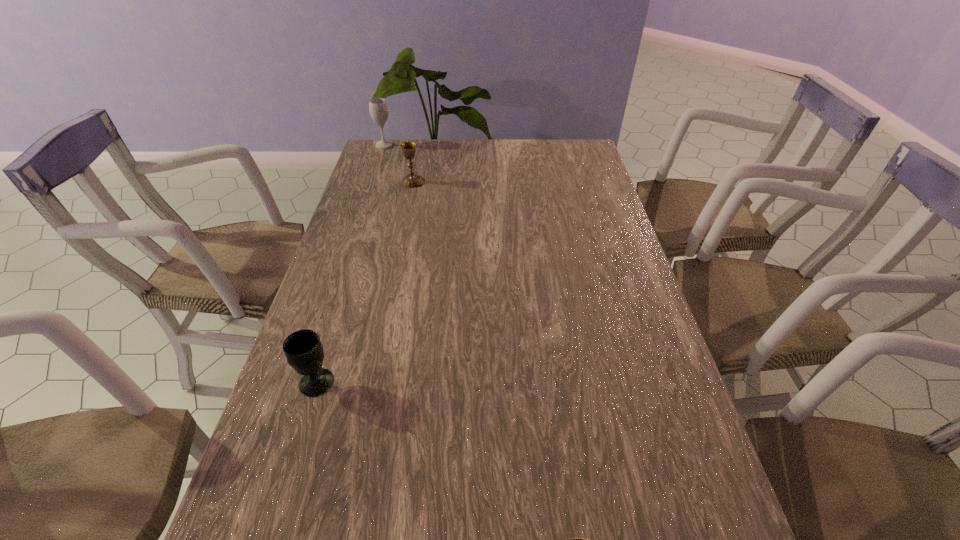
Locate an element on the screen. Image resolution: width=960 pixels, height=540 pixels. wineglass is located at coordinates (378, 108).

You are a GUI agent. You are given a task and a screenshot of the screen. Output one action in this format:
    pyautogui.click(x=<x>, y=<y>)
    Task: Click on the farthest object
    The height and width of the screenshot is (540, 960).
    Given the screenshot: What is the action you would take?
    pyautogui.click(x=378, y=108)

The image size is (960, 540). In order to click on the third object from left to right in this screenshot , I will do `click(413, 180)`.

Find the location of a particular element. This screenshot has width=960, height=540. the farthest chalice is located at coordinates (413, 180).

The image size is (960, 540). What are the coordinates of `the third farthest object` in the screenshot? It's located at (303, 349).

This screenshot has width=960, height=540. I want to click on the second nearest chalice, so click(x=303, y=349).

You are a GUI agent. You are given a task and a screenshot of the screen. Output one action in this format:
    pyautogui.click(x=<x>, y=<y>)
    Task: Click on the vacant space located on the right of the tallest object
    This screenshot has width=960, height=540.
    Given the screenshot: What is the action you would take?
    pyautogui.click(x=432, y=145)

Identify the location of vacant space located 0.360m on the right of the second chalice from left to right. (523, 181).

At what (x,y) coordinates should I click in order to perform the action: click on vacant point located on the back of the third farthest object. Please return your answer as a coordinate pair (x, y). The height and width of the screenshot is (540, 960). Looking at the image, I should click on (346, 287).

Locate an element on the screen. This screenshot has height=540, width=960. object present at the far edge is located at coordinates (378, 108).